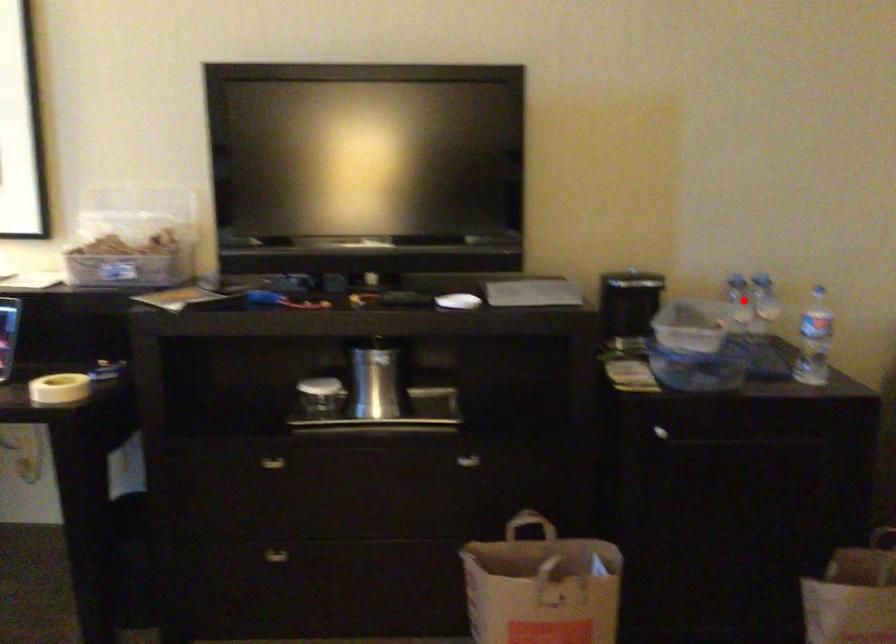
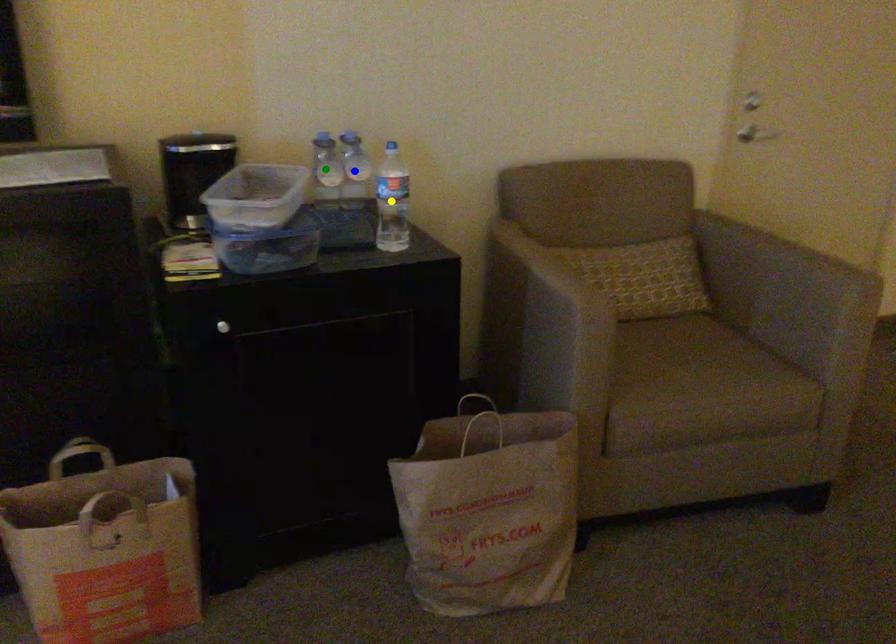
Question: I am providing you with two images of the same scene from different viewpoints. A red point is marked on the first image. You are given multiple points on the second image. Which point in image 2 is actually the same real-world point as the red point in image 1?

Choices:
 (A) yellow point
 (B) blue point
 (C) green point

Answer: (C)